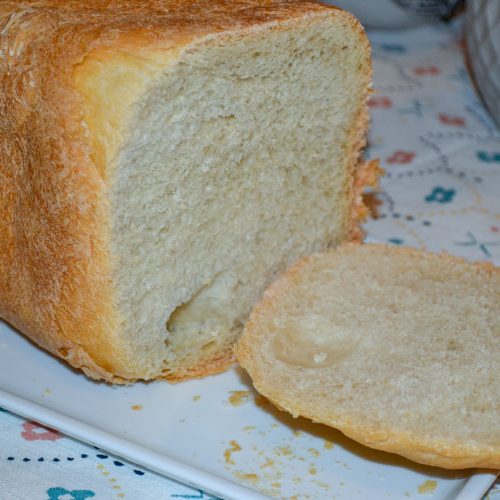
Where is `edge of plate`? The height and width of the screenshot is (500, 500). edge of plate is located at coordinates (177, 467).